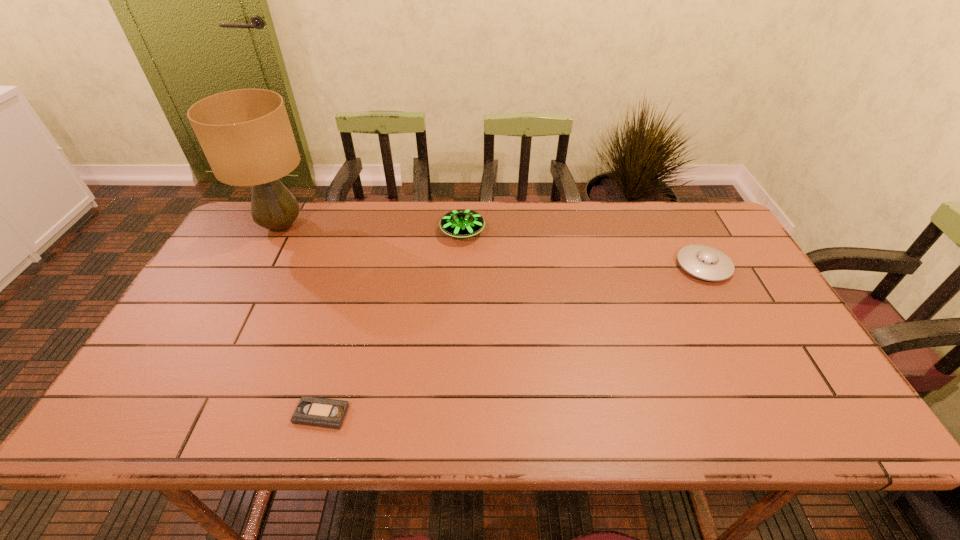
Where is `the leftmost object`? the leftmost object is located at coordinates (246, 136).

You are a GUI agent. You are given a task and a screenshot of the screen. Output one action in this format:
    pyautogui.click(x=<x>, y=<y>)
    Task: Click on the lampshade
    The height and width of the screenshot is (540, 960).
    Given the screenshot: What is the action you would take?
    (x=246, y=136)

This screenshot has height=540, width=960. Find the location of `the second tallest object`. the second tallest object is located at coordinates (462, 223).

Where is `the farther saucer`? the farther saucer is located at coordinates (462, 223).

At what (x,y) coordinates should I click in order to perform the action: click on the rightmost object. Please return your answer as a coordinate pair (x, y). Looking at the image, I should click on (707, 263).

You are a GUI agent. You are given a task and a screenshot of the screen. Output one action in this format:
    pyautogui.click(x=<x>, y=<y>)
    Task: Click on the shorter saucer
    Image resolution: width=960 pixels, height=540 pixels.
    Given the screenshot: What is the action you would take?
    pyautogui.click(x=707, y=263)

This screenshot has width=960, height=540. I want to click on the second object from left to right, so click(x=311, y=411).

The height and width of the screenshot is (540, 960). What are the coordinates of `the shortest object` in the screenshot? It's located at (311, 411).

You are a GUI agent. You are given a task and a screenshot of the screen. Output one action in this format:
    pyautogui.click(x=<x>, y=<y>)
    Task: Click on the free spot located on the front of the leftmost object
    The height and width of the screenshot is (540, 960).
    Given the screenshot: What is the action you would take?
    pyautogui.click(x=258, y=269)

I want to click on free space located on the front of the farther saucer, so click(461, 273).